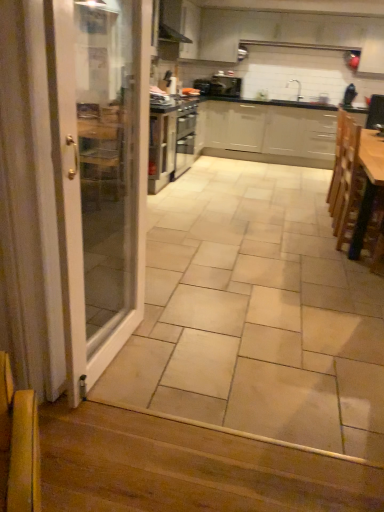
Question: Based on their positions, is wooden table at right located to the left or right of beige ceramic tile at center?

Choices:
 (A) left
 (B) right

Answer: (B)

Question: Does point (359, 251) appear closer or farther from the camera than point (170, 330)?

Choices:
 (A) farther
 (B) closer

Answer: (A)

Question: Estimate the real-world distances between objects in this image. Which object is closer to the wooden at lower left?

Choices:
 (A) beige ceramic tile at center
 (B) wooden table at right
 (C) wooden armchair at lower left
 (D) black matte exhaust hood at upper center

Answer: (C)

Question: Which object is positioned closest to the wooden table at right?

Choices:
 (A) beige ceramic tile at center
 (B) black matte exhaust hood at upper center
 (C) wooden at lower left
 (D) wooden armchair at lower left

Answer: (A)